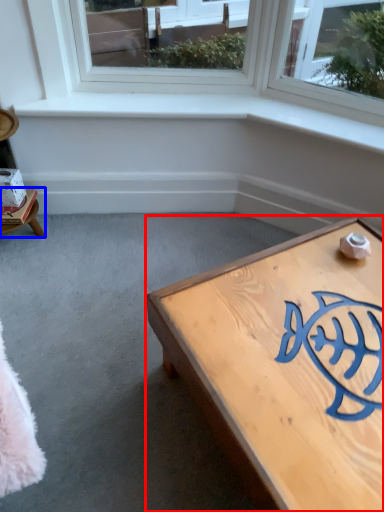
Question: Which object is closer to the camera taking this photo, coffee table (highlighted by a red box) or furniture (highlighted by a blue box)?

Choices:
 (A) coffee table
 (B) furniture

Answer: (A)